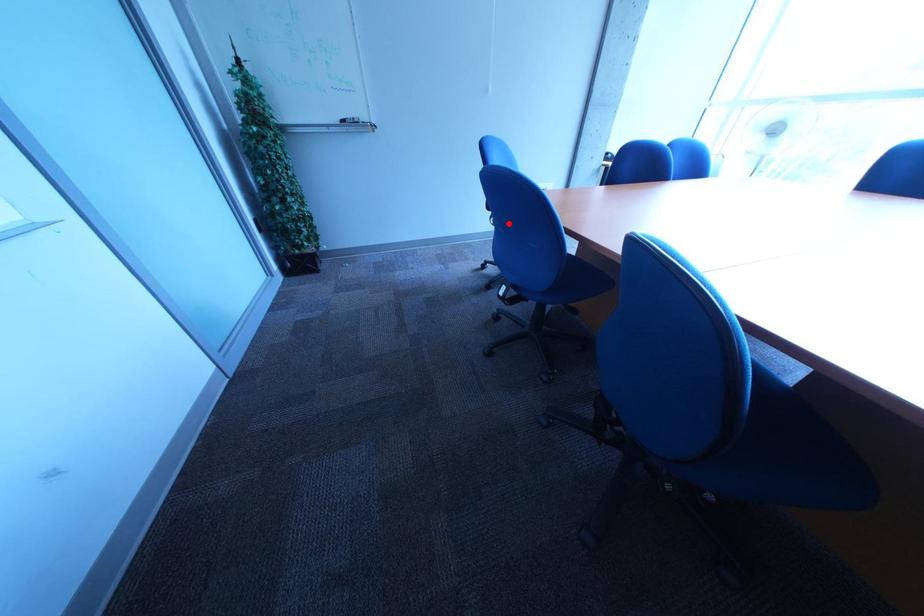
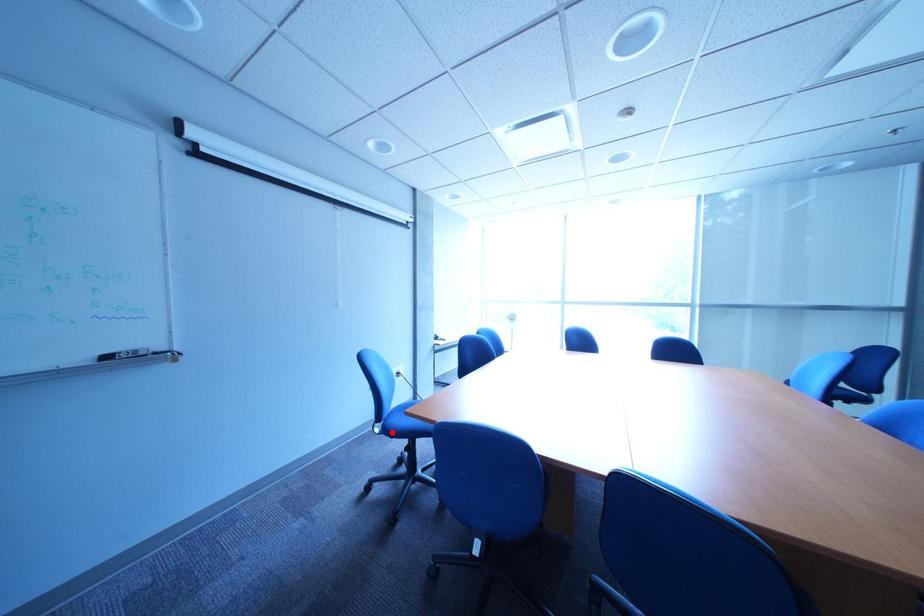
I am providing you with two images of the same scene from different viewpoints. A red point is marked on the first image and another point is marked on the second image. Are the points marked in image1 and image2 representing the same 3D position?

Yes